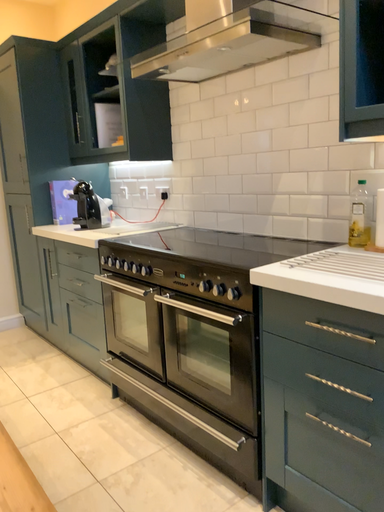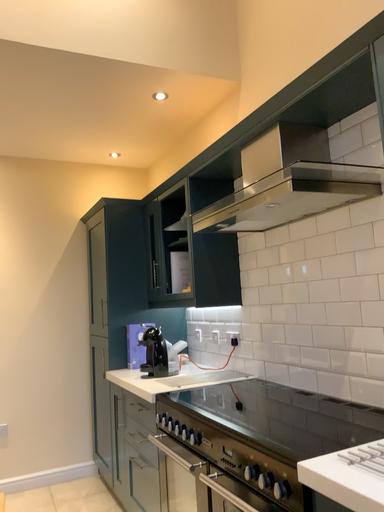
Question: Which way did the camera rotate in the video?

Choices:
 (A) rotated left
 (B) rotated right

Answer: (A)